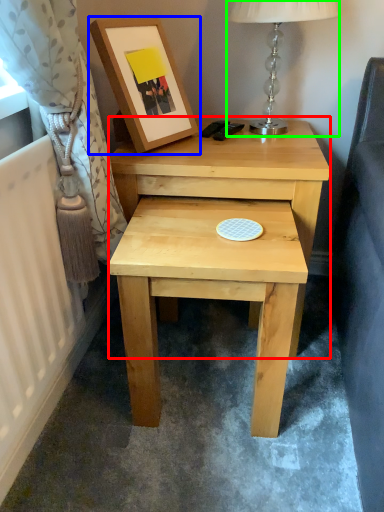
Question: Which object is positioned farthest from nightstand (highlighted by a red box)? Select from picture frame (highlighted by a blue box) and table lamp (highlighted by a green box).

Choices:
 (A) picture frame
 (B) table lamp

Answer: (B)